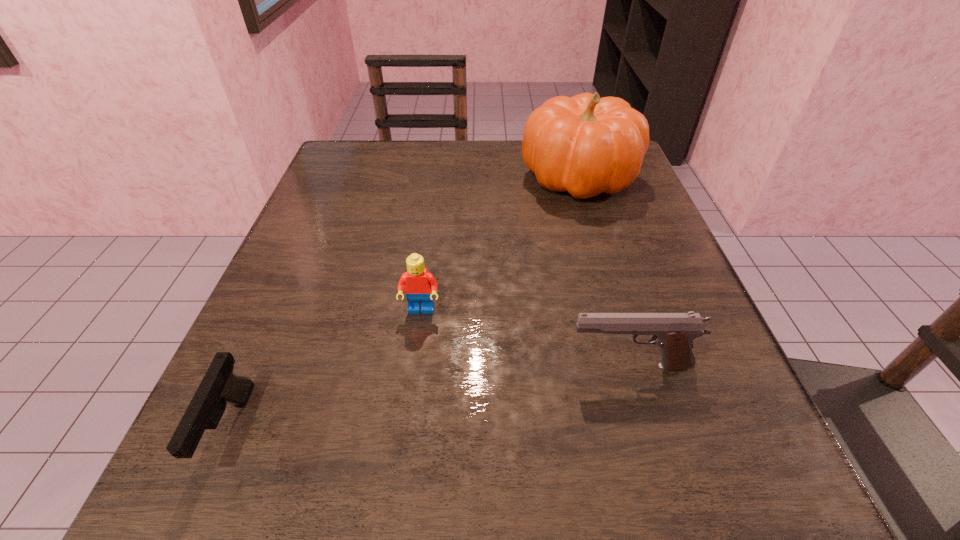
I want to click on pumpkin, so click(586, 145).

Locate an element on the screen. The width and height of the screenshot is (960, 540). the tallest object is located at coordinates (586, 145).

I want to click on the taller pistol, so click(x=674, y=332).

The width and height of the screenshot is (960, 540). In order to click on the right pistol in this screenshot , I will do `click(674, 332)`.

Find the location of `the second object from left to right`. the second object from left to right is located at coordinates (419, 284).

At what (x,y) coordinates should I click in order to perform the action: click on the third nearest object. Please return your answer as a coordinate pair (x, y). The height and width of the screenshot is (540, 960). Looking at the image, I should click on (419, 284).

You are a GUI agent. You are given a task and a screenshot of the screen. Output one action in this format:
    pyautogui.click(x=<x>, y=<y>)
    Task: Click on the leftmost object
    Image resolution: width=960 pixels, height=540 pixels.
    Given the screenshot: What is the action you would take?
    pyautogui.click(x=219, y=386)

At what (x,y) coordinates should I click in order to perform the action: click on the shorter pistol. Please return your answer as a coordinate pair (x, y). The image size is (960, 540). Looking at the image, I should click on (219, 386).

Where is `vacant space located 0.350m on the front of the tallest object`? This screenshot has height=540, width=960. vacant space located 0.350m on the front of the tallest object is located at coordinates (631, 349).

Image resolution: width=960 pixels, height=540 pixels. I want to click on free space located 0.160m at the barrel of the farther pistol, so click(x=456, y=366).